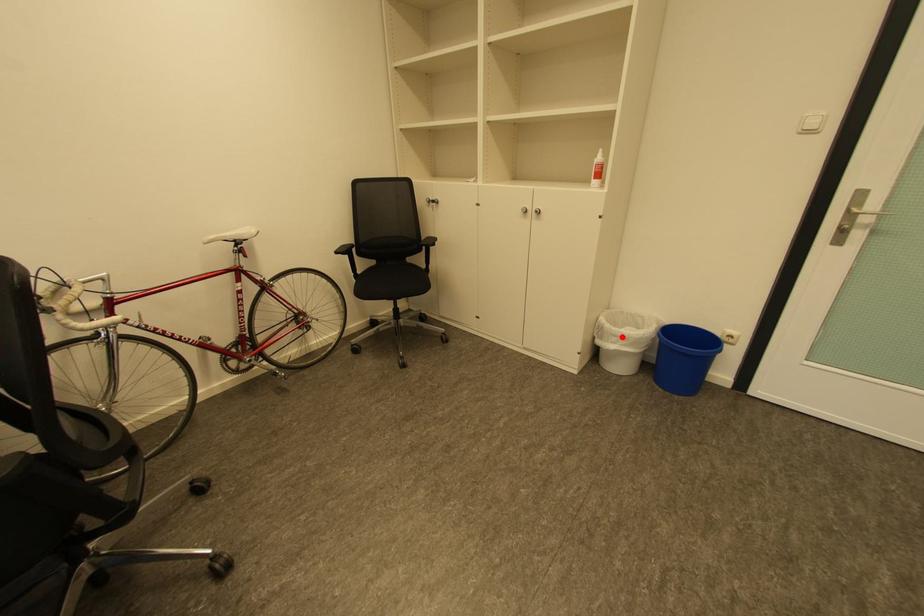
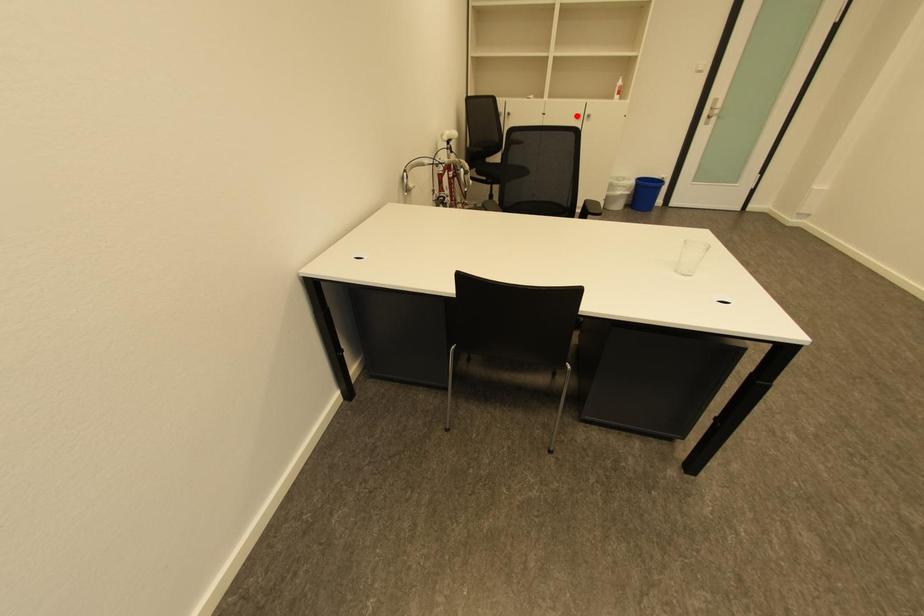
I am providing you with two images of the same scene from different viewpoints. A red point is marked on the first image and another point is marked on the second image. Do the highlighted points in image1 and image2 indicate the same real-world spot?

No